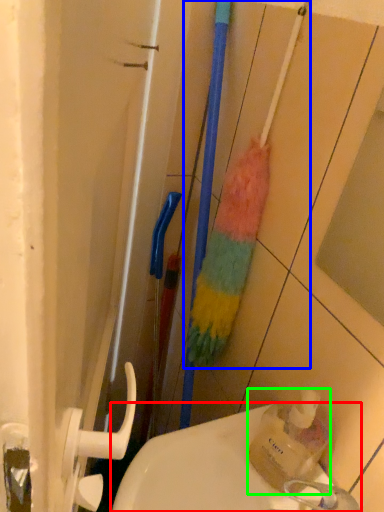
Question: Estimate the real-world distances between objects in this image. Which object is closer to sink (highlighted by a red box), brush (highlighted by a blue box) or bottle (highlighted by a green box)?

Choices:
 (A) brush
 (B) bottle

Answer: (B)